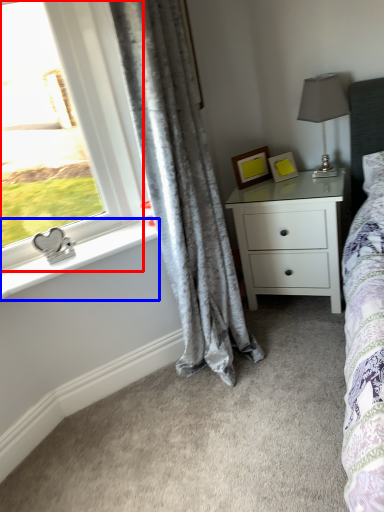
Question: Among these objects, which one is farthest to the camera, window (highlighted by a red box) or window sill (highlighted by a blue box)?

Choices:
 (A) window
 (B) window sill

Answer: (B)